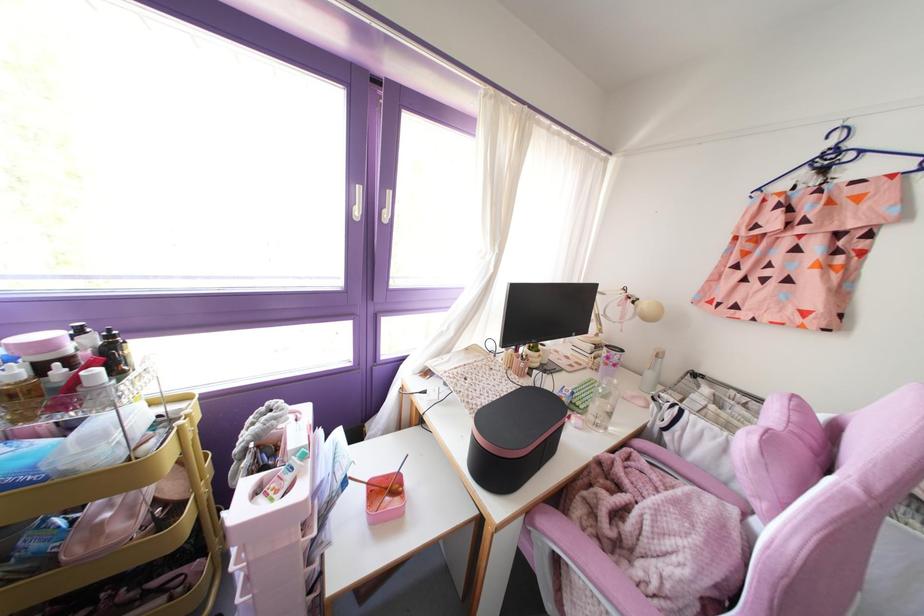
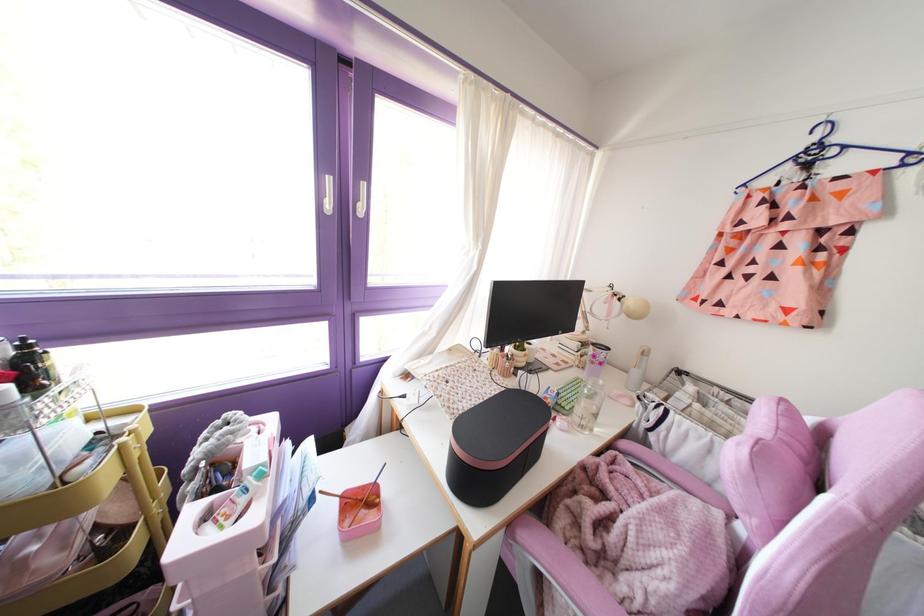
Where in the second image is the point corresponding to (x=649, y=374) from the first image?

(634, 371)